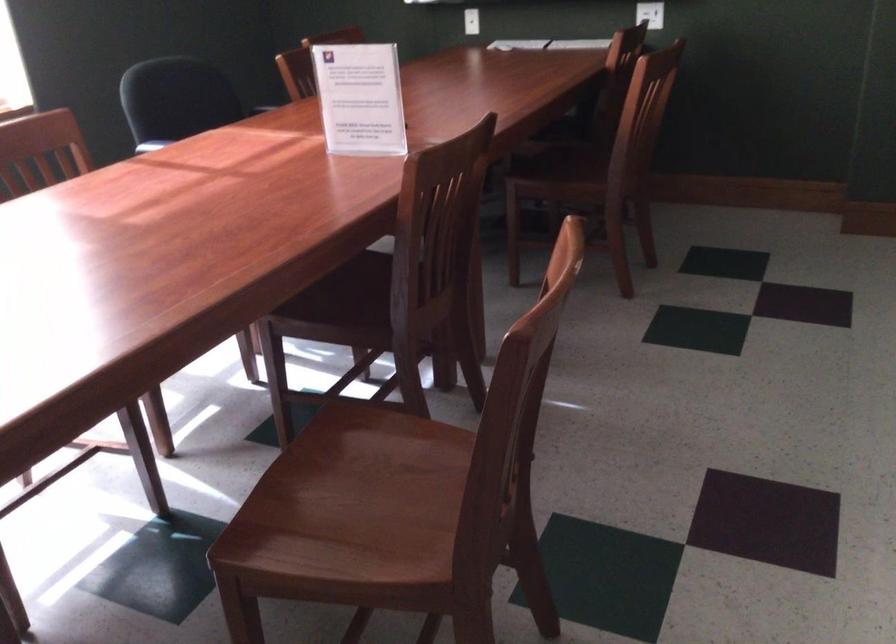
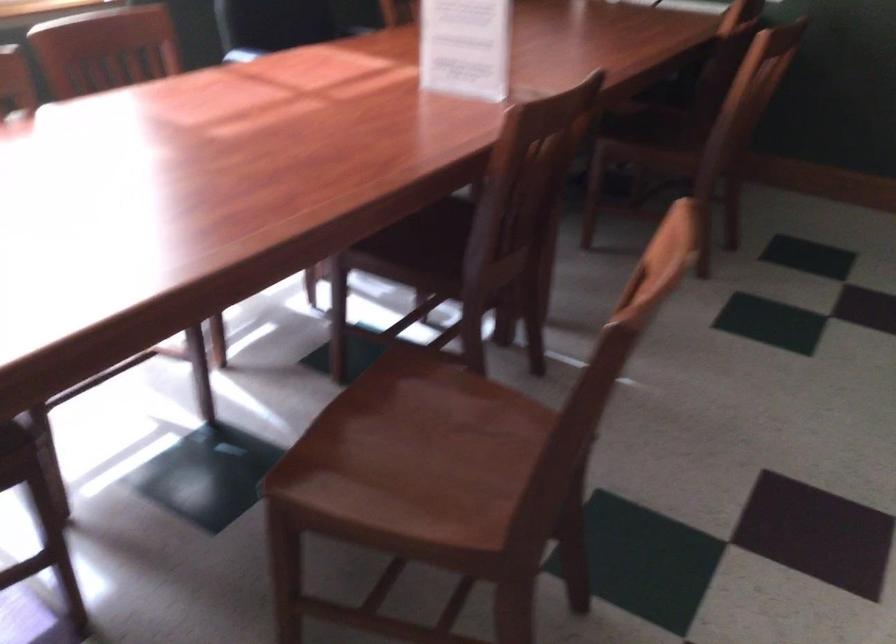
Find the pixel in the second image that matches [358,506] in the first image.

(412, 458)